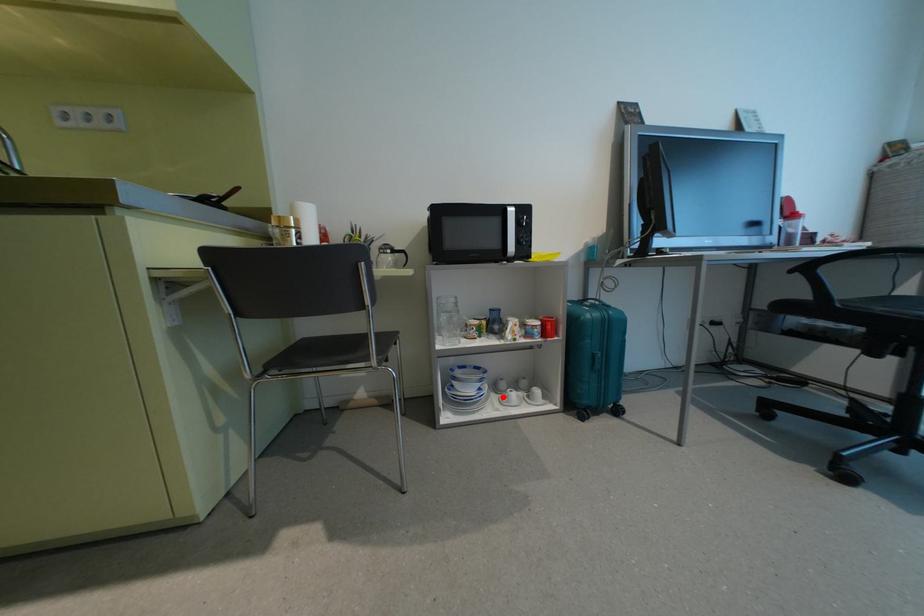
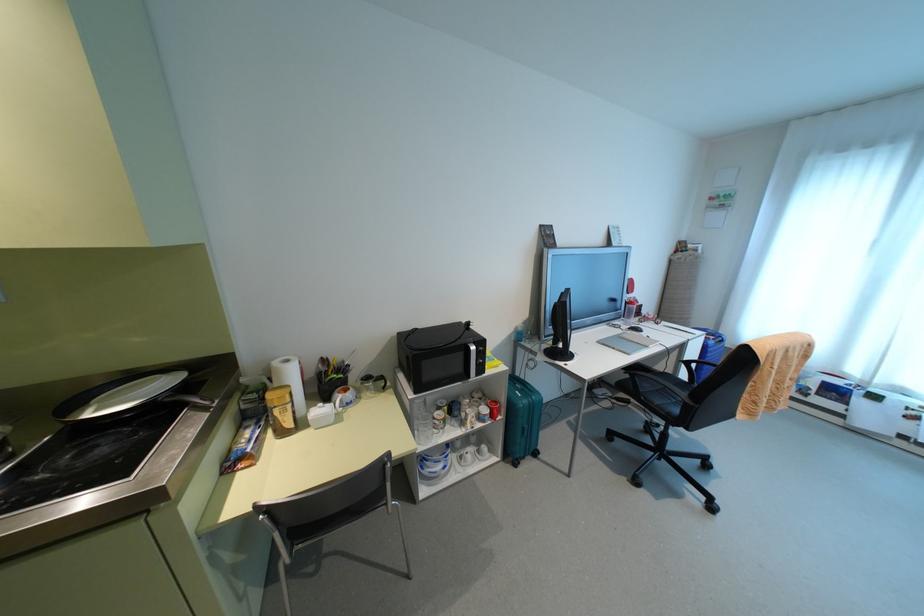
Question: I am providing you with two images of the same scene from different viewpoints. A red point is shown in image1. For the corresponding object point in image2, is it positioned nearer or farther from the camera?

Choices:
 (A) Nearer
 (B) Farther

Answer: (B)